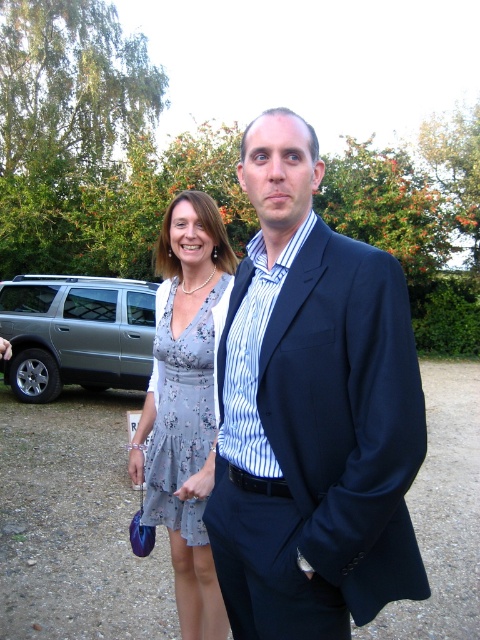
Question: Is floral dress at center closer to camera compared to floral-patterned fabric dress at center?

Choices:
 (A) yes
 (B) no

Answer: (A)

Question: Which point appears closest to the camera in this image?

Choices:
 (A) (175, 509)
 (B) (188, 266)
 (C) (267, 164)

Answer: (C)

Question: Among these objects, which one is farthest from the camera?

Choices:
 (A) floral-patterned fabric dress at center
 (B) floral dress at center
 (C) dark blue suit at center
 (D) satin silver suv at lower left

Answer: (D)

Question: Can you confirm if satin silver suv at lower left is smaller than floral-patterned fabric dress at center?

Choices:
 (A) yes
 (B) no

Answer: (B)

Question: Considering the real-world distances, which object is farthest from the dark blue suit at center?

Choices:
 (A) floral dress at center
 (B) floral-patterned fabric dress at center
 (C) satin silver suv at lower left

Answer: (C)

Question: From the image, what is the correct spatial relationship of dark blue suit at center in relation to floral-patterned fabric dress at center?

Choices:
 (A) above
 (B) below

Answer: (A)